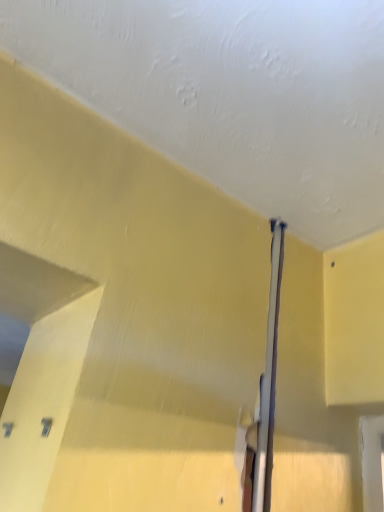
This screenshot has height=512, width=384. What do you see at coordinates (268, 381) in the screenshot?
I see `metallic silver pole at center` at bounding box center [268, 381].

Measure the distance between point [265,458] and camera.

A distance of 72.50 centimeters exists between point [265,458] and camera.

Where is `metallic silver pole at center`? This screenshot has width=384, height=512. metallic silver pole at center is located at coordinates click(x=268, y=381).

Find the location of a particular element. The height and width of the screenshot is (512, 384). metallic silver pole at center is located at coordinates (268, 381).